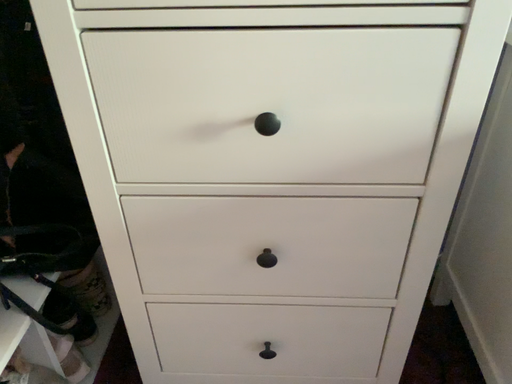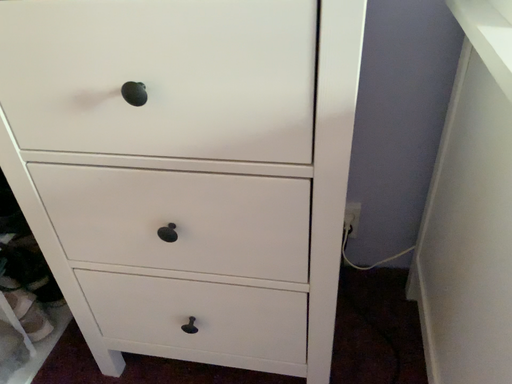
Question: How did the camera likely rotate when shooting the video?

Choices:
 (A) rotated right
 (B) rotated left

Answer: (B)